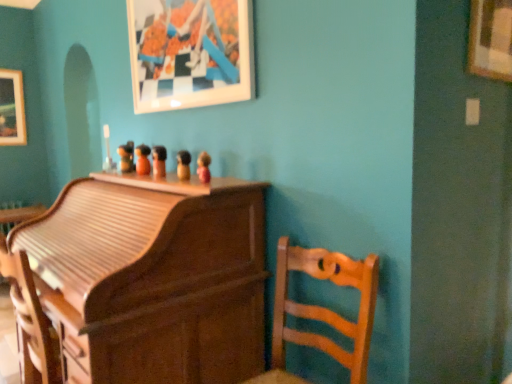
Question: Is matte white picture frame at upper center, the second picture frame viewed from the right, facing towards wooden figurine at center, the 5th toy when ordered from right to left?

Choices:
 (A) no
 (B) yes

Answer: (A)

Question: Considering the relative sizes of matte white picture frame at upper center, the second picture frame positioned from the front, and wooden figurine at center, the first toy when ordered from back to front, in the image provided, is matte white picture frame at upper center, the second picture frame positioned from the front, smaller than wooden figurine at center, the first toy when ordered from back to front,?

Choices:
 (A) yes
 (B) no

Answer: (B)

Question: Is matte white picture frame at upper center, the second picture frame viewed from the back, not within wooden figurine at center, which ranks as the fifth toy in front-to-back order?

Choices:
 (A) no
 (B) yes

Answer: (B)

Question: Does matte white picture frame at upper center, which appears as the second picture frame when viewed from the left, have a lesser width compared to wooden figurine at center, the 5th toy when ordered from right to left?

Choices:
 (A) yes
 (B) no

Answer: (A)

Question: Considering the positions of wooden figurine at center, marked as the second toy in a right-to-left arrangement, and wooden figurine at center, which ranks as the fifth toy in front-to-back order, in the image, is wooden figurine at center, marked as the second toy in a right-to-left arrangement, wider or thinner than wooden figurine at center, which ranks as the fifth toy in front-to-back order,?

Choices:
 (A) thin
 (B) wide

Answer: (A)

Question: Is wooden figurine at center, the 2th toy from the front, taller or shorter than wooden figurine at center, the 5th toy when ordered from right to left?

Choices:
 (A) tall
 (B) short

Answer: (B)

Question: Visually, is wooden figurine at center, the 2th toy from the front, positioned to the left or to the right of wooden figurine at center, which ranks as the fifth toy in front-to-back order?

Choices:
 (A) right
 (B) left

Answer: (A)

Question: Looking at the image, does wooden figurine at center, which is counted as the fourth toy, starting from the left, seem bigger or smaller compared to wooden figurine at center, the first toy when ordered from back to front?

Choices:
 (A) small
 (B) big

Answer: (A)

Question: Choose the correct answer: Is wooden roll-top desk at center, acting as the 1th furniture starting from the left, inside wooden figurine at center, the 1th toy when ordered from left to right, or outside it?

Choices:
 (A) inside
 (B) outside

Answer: (B)

Question: From a real-world perspective, is wooden roll-top desk at center, acting as the 1th furniture starting from the left, physically located above or below wooden figurine at center, the 5th toy when ordered from right to left?

Choices:
 (A) below
 (B) above

Answer: (A)

Question: In terms of width, does wooden roll-top desk at center, acting as the 1th furniture starting from the left, look wider or thinner when compared to wooden figurine at center, the first toy when ordered from back to front?

Choices:
 (A) wide
 (B) thin

Answer: (A)

Question: In the image, is wooden roll-top desk at center, acting as the 1th furniture starting from the left, on the left side or the right side of wooden figurine at center, the 1th toy when ordered from left to right?

Choices:
 (A) left
 (B) right

Answer: (B)

Question: Considering the positions of wooden roll-top desk at center, which is the second furniture in right-to-left order, and wooden figurine at center, marked as the second toy in a right-to-left arrangement, in the image, is wooden roll-top desk at center, which is the second furniture in right-to-left order, taller or shorter than wooden figurine at center, marked as the second toy in a right-to-left arrangement,?

Choices:
 (A) short
 (B) tall

Answer: (B)

Question: Considering the positions of wooden roll-top desk at center, acting as the 1th furniture starting from the left, and wooden figurine at center, which is counted as the fourth toy, starting from the left, in the image, is wooden roll-top desk at center, acting as the 1th furniture starting from the left, wider or thinner than wooden figurine at center, which is counted as the fourth toy, starting from the left,?

Choices:
 (A) wide
 (B) thin

Answer: (A)